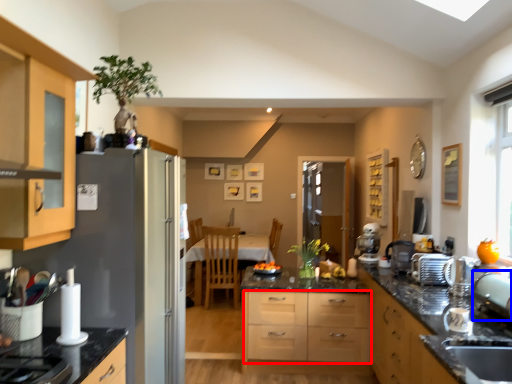
Question: Among these objects, which one is nearest to the camera, drawer (highlighted by a red box) or appliance (highlighted by a blue box)?

Choices:
 (A) drawer
 (B) appliance

Answer: (B)